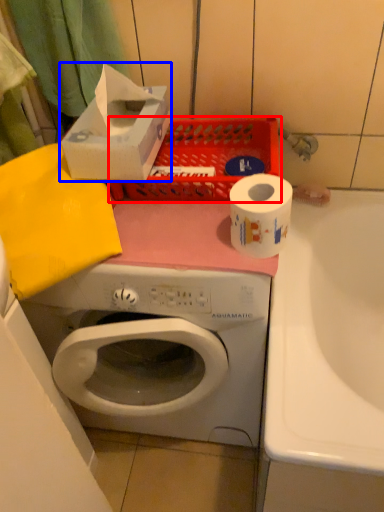
Question: Which point is further to the camera, basket (highlighted by a red box) or storage box (highlighted by a blue box)?

Choices:
 (A) basket
 (B) storage box

Answer: (A)